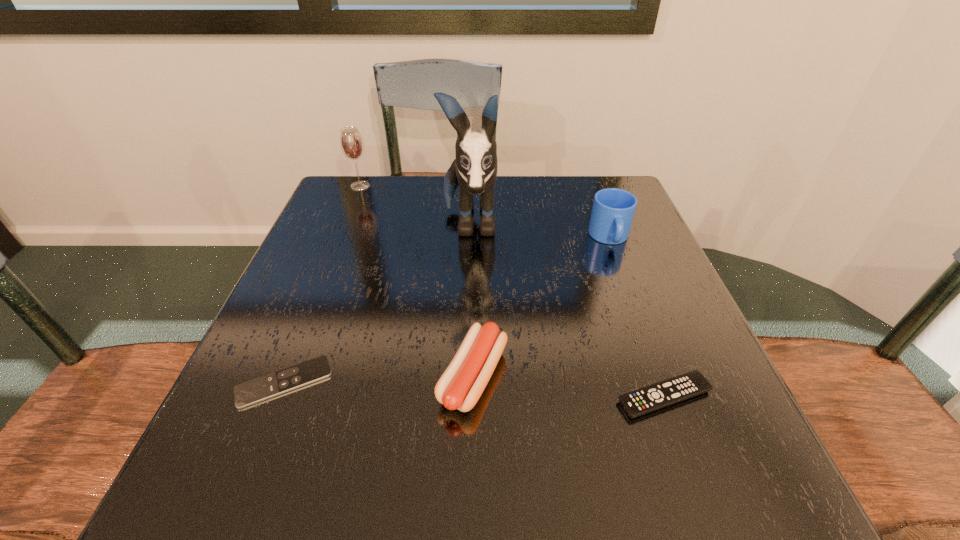
Where is `object identified as the third closest to the wineglass`? object identified as the third closest to the wineglass is located at coordinates (461, 385).

In order to click on object that stands as the second closest to the tallest object in this screenshot , I will do 461,385.